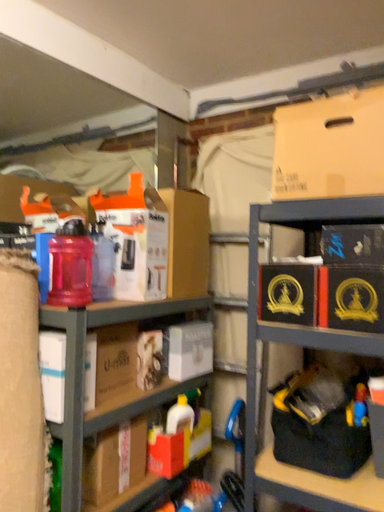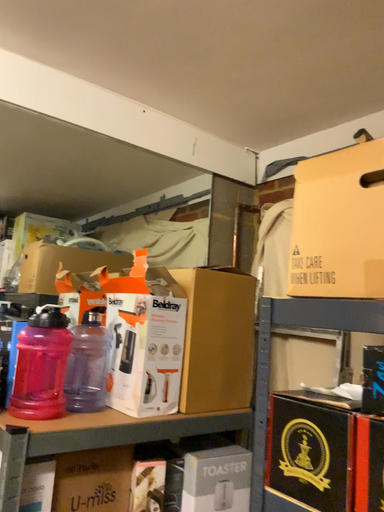
Question: How did the camera likely rotate when shooting the video?

Choices:
 (A) rotated downward
 (B) rotated upward

Answer: (B)